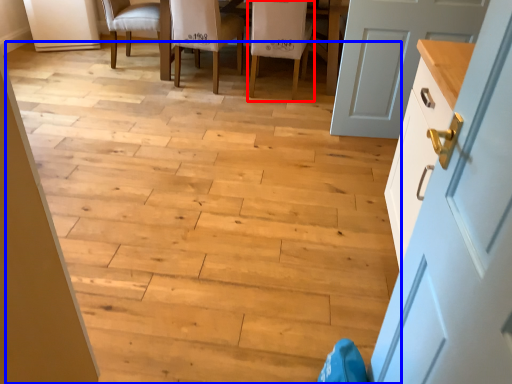
Question: Which object appears closest to the camera in this image, chair (highlighted by a red box) or stair (highlighted by a blue box)?

Choices:
 (A) chair
 (B) stair

Answer: (B)